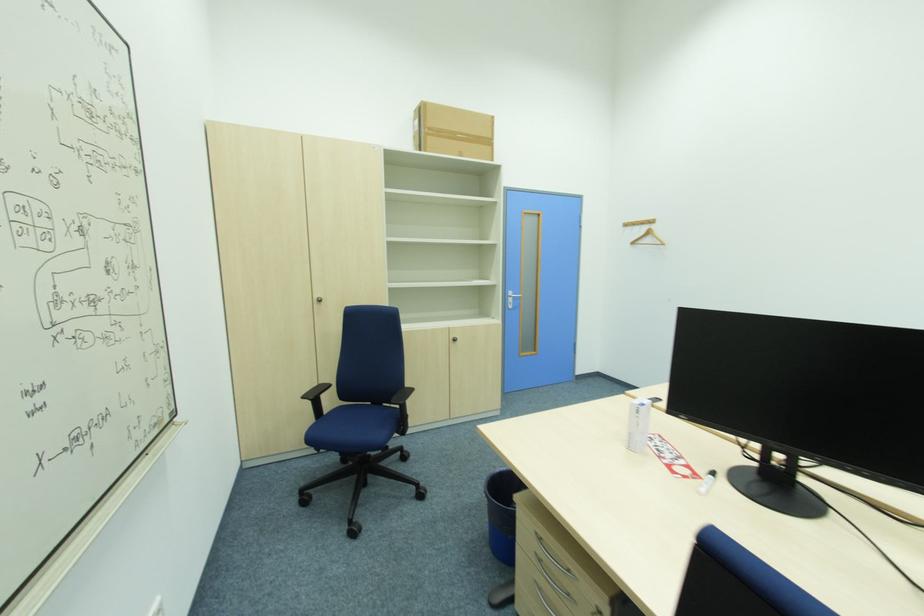
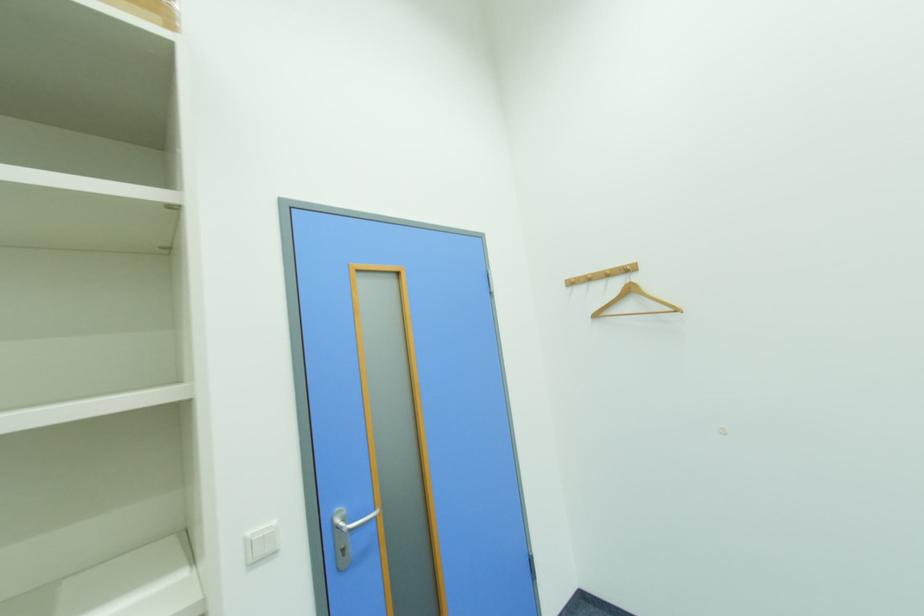
Question: What movement of the cameraman would produce the second image?

Choices:
 (A) Left
 (B) Right
 (C) Forward
 (D) Backward

Answer: (C)